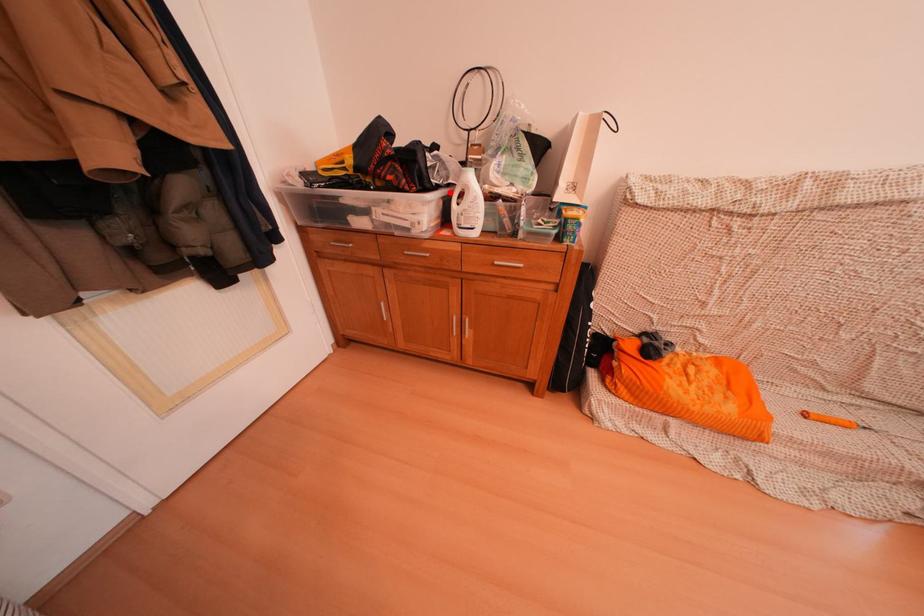
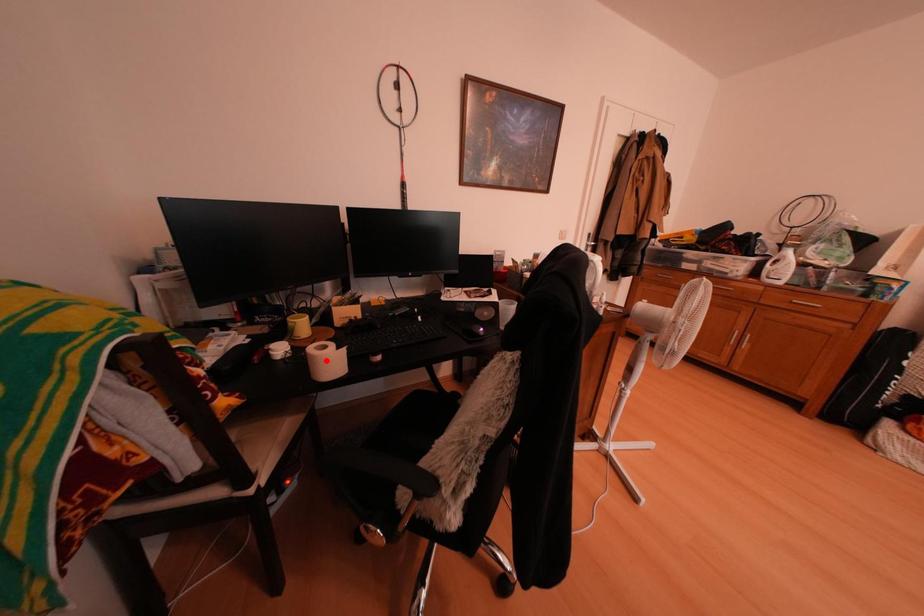
I am providing you with two images of the same scene from different viewpoints. A red point is marked on the first image and another point is marked on the second image. Does the point marked in image1 correspond to the same location as the one in image2?

No